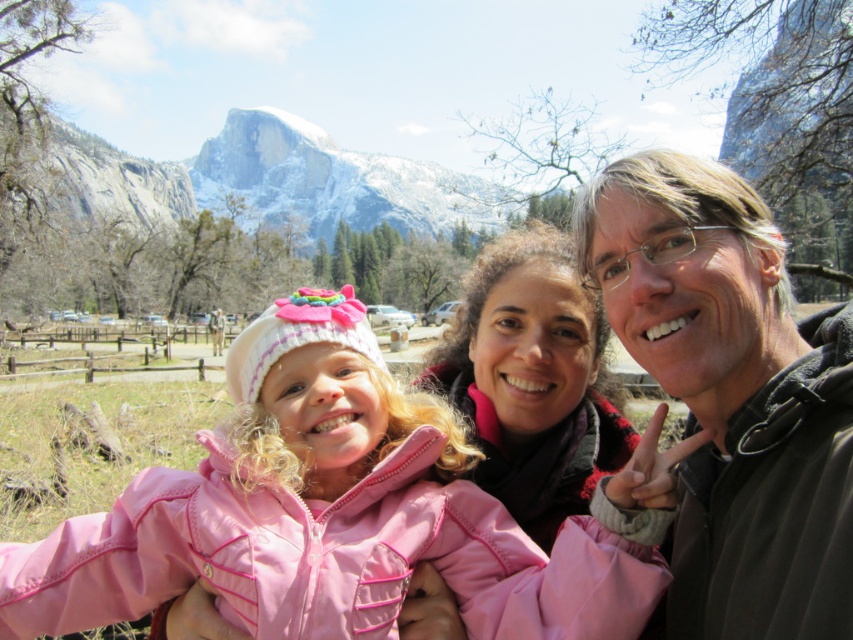
Question: Which object appears closest to the camera in this image?

Choices:
 (A) matte pink jacket at center
 (B) dark brown fleece jacket at right

Answer: (B)

Question: Is matte black jacket at right thinner than matte pink jacket at center?

Choices:
 (A) yes
 (B) no

Answer: (A)

Question: Does matte pink jacket at center appear on the left side of snowy granite mountain at upper center?

Choices:
 (A) no
 (B) yes

Answer: (A)

Question: Is pink fleece jacket at center smaller than dark brown fleece jacket at right?

Choices:
 (A) yes
 (B) no

Answer: (B)

Question: Which of the following is the closest to the observer?

Choices:
 (A) (515, 371)
 (B) (740, 604)

Answer: (B)

Question: Which is farther from the pink fleece jacket at center?

Choices:
 (A) snowy granite mountain at upper center
 (B) matte pink jacket at center
 (C) dark brown fleece jacket at right
 (D) matte black jacket at right

Answer: (A)